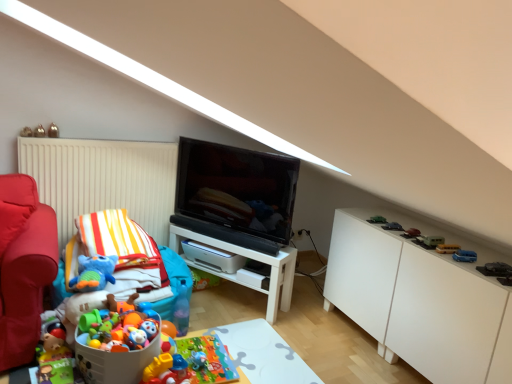
Locate an element on the screen. The width and height of the screenshot is (512, 384). free location in front of green matte toy car at right, which is the fourth toy from right to left is located at coordinates (451, 254).